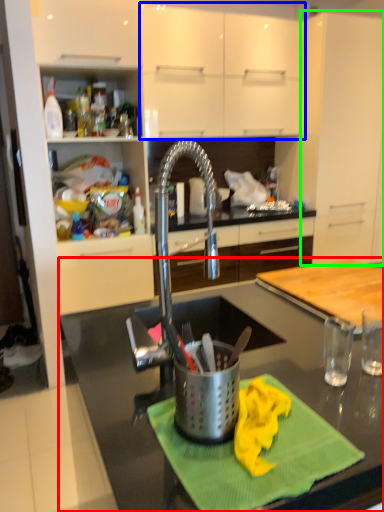
Question: Which is farther away from countertop (highlighted by a red box)? cabinetry (highlighted by a blue box) or cabinetry (highlighted by a green box)?

Choices:
 (A) cabinetry
 (B) cabinetry

Answer: (B)